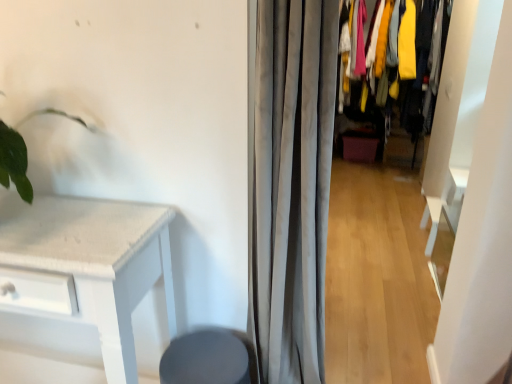
Question: Are gray fabric curtain at center and textured fabric closet at center far apart?

Choices:
 (A) no
 (B) yes

Answer: (B)

Question: Is gray fabric curtain at center next to textured fabric closet at center?

Choices:
 (A) no
 (B) yes

Answer: (A)

Question: Can you confirm if gray fabric curtain at center is positioned to the right of textured fabric closet at center?

Choices:
 (A) yes
 (B) no

Answer: (B)

Question: Considering the relative sizes of gray fabric curtain at center and textured fabric closet at center in the image provided, is gray fabric curtain at center taller than textured fabric closet at center?

Choices:
 (A) no
 (B) yes

Answer: (A)

Question: Considering the relative positions of gray fabric curtain at center and textured fabric closet at center in the image provided, is gray fabric curtain at center in front of textured fabric closet at center?

Choices:
 (A) yes
 (B) no

Answer: (A)

Question: Is gray fabric curtain at center behind textured fabric closet at center?

Choices:
 (A) yes
 (B) no

Answer: (B)

Question: Considering the relative sizes of gray fabric curtain at center and matte gray swivel chair at lower center in the image provided, is gray fabric curtain at center shorter than matte gray swivel chair at lower center?

Choices:
 (A) yes
 (B) no

Answer: (B)

Question: From a real-world perspective, does gray fabric curtain at center sit lower than matte gray swivel chair at lower center?

Choices:
 (A) yes
 (B) no

Answer: (B)

Question: Is gray fabric curtain at center completely or partially outside of matte gray swivel chair at lower center?

Choices:
 (A) no
 (B) yes

Answer: (B)

Question: Does gray fabric curtain at center lie behind matte gray swivel chair at lower center?

Choices:
 (A) yes
 (B) no

Answer: (B)

Question: Could matte gray swivel chair at lower center be considered to be inside gray fabric curtain at center?

Choices:
 (A) no
 (B) yes

Answer: (A)

Question: Considering the relative positions of gray fabric curtain at center and matte gray swivel chair at lower center in the image provided, is gray fabric curtain at center to the left of matte gray swivel chair at lower center from the viewer's perspective?

Choices:
 (A) yes
 (B) no

Answer: (B)

Question: Does textured fabric closet at center turn towards gray fabric curtain at center?

Choices:
 (A) no
 (B) yes

Answer: (B)